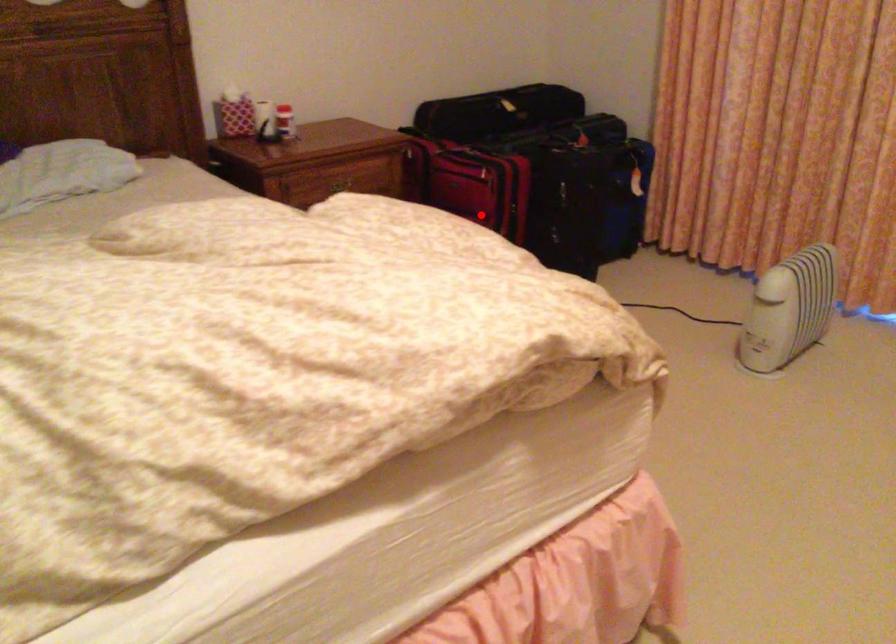
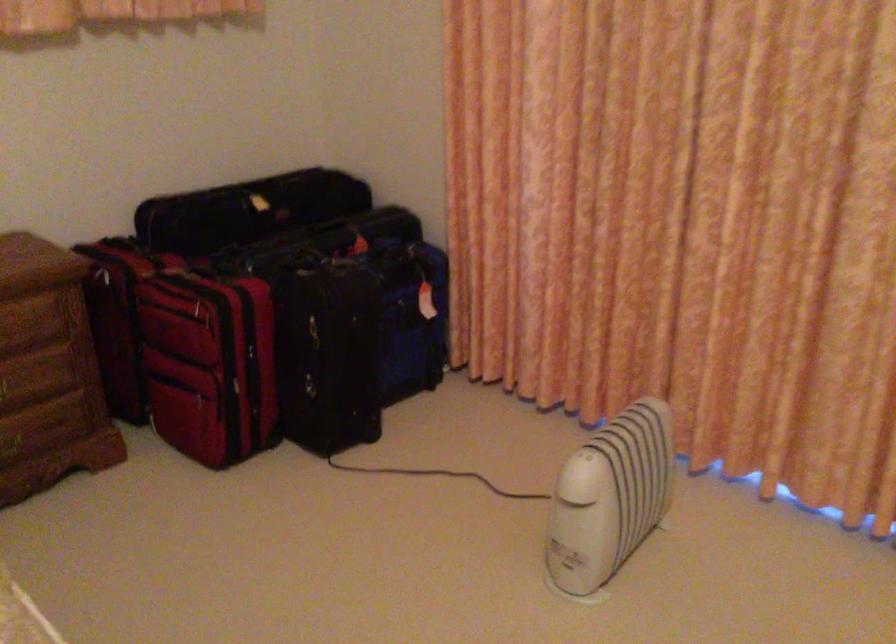
Question: I am providing you with two images of the same scene from different viewpoints. In image1, a red point is highlighted. Considering the same 3D point in image2, which of the following is correct?

Choices:
 (A) It is closer
 (B) It is farther

Answer: (A)